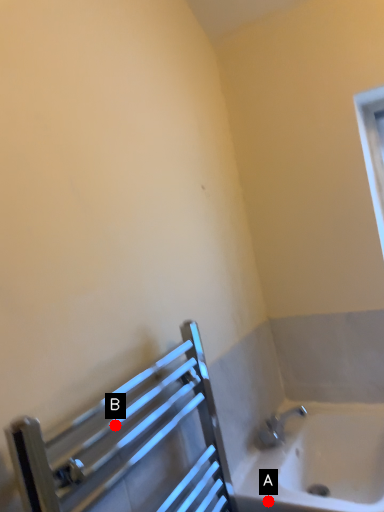
Question: Two points are circled on the image, labeled by A and B beside each circle. Which point is farther from the camera taking this photo?

Choices:
 (A) A is further
 (B) B is further

Answer: (A)